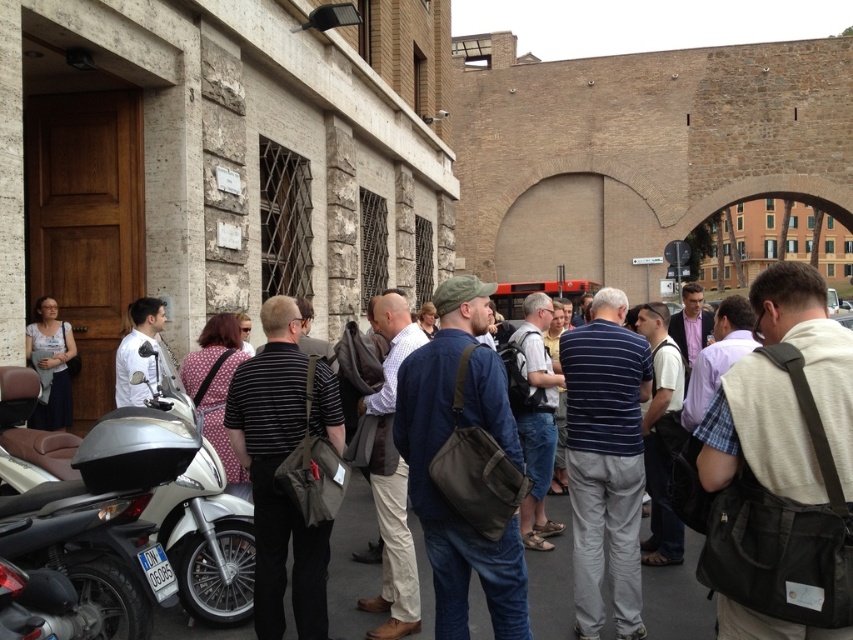
You are a delivery person who needs to quickly move a package from the silver metallic scooter at lower left to the dark blue jeans at center. Considering their heights, will you need to adjust your posture to reach the package on the scooter?

The silver metallic scooter at lower left is shorter than the dark blue jeans at center, so you will need to bend down to reach the package on the scooter since it is lower than the height of the person wearing the dark blue jeans at center.

You are a tourist standing at the street corner and want to take a photo of the dark blue jeans at center without the silver metallic scooter at lower left blocking the view. Is it possible to do so?

The silver metallic scooter at lower left is further to the viewer than dark blue jeans at center, so it is blocking the view. To take a photo of the dark blue jeans at center without the scooter blocking, you would need to move around the scooter to the right or left to position yourself where the scooter is no longer in front of the jeans.